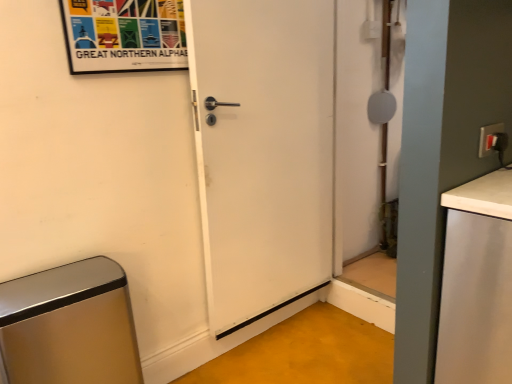
Question: Can we say metallic brushed trash can at lower left lies outside white matte countertop at right?

Choices:
 (A) yes
 (B) no

Answer: (A)

Question: Can you confirm if metallic brushed trash can at lower left is smaller than white matte countertop at right?

Choices:
 (A) yes
 (B) no

Answer: (A)

Question: Can you confirm if metallic brushed trash can at lower left is thinner than white matte countertop at right?

Choices:
 (A) yes
 (B) no

Answer: (A)

Question: Is metallic brushed trash can at lower left turned away from white matte countertop at right?

Choices:
 (A) yes
 (B) no

Answer: (B)

Question: From the image's perspective, does metallic brushed trash can at lower left appear lower than white matte countertop at right?

Choices:
 (A) yes
 (B) no

Answer: (A)

Question: Is matte white screen door at right bigger or smaller than white matte countertop at right?

Choices:
 (A) small
 (B) big

Answer: (A)

Question: In terms of height, does matte white screen door at right look taller or shorter compared to white matte countertop at right?

Choices:
 (A) tall
 (B) short

Answer: (A)

Question: Is matte white screen door at right inside the boundaries of white matte countertop at right, or outside?

Choices:
 (A) outside
 (B) inside

Answer: (A)

Question: From a real-world perspective, is matte white screen door at right physically located above or below white matte countertop at right?

Choices:
 (A) above
 (B) below

Answer: (A)

Question: Considering the positions of metallic brushed trash can at lower left and white matte countertop at right in the image, is metallic brushed trash can at lower left bigger or smaller than white matte countertop at right?

Choices:
 (A) small
 (B) big

Answer: (A)

Question: Is metallic brushed trash can at lower left situated inside white matte countertop at right or outside?

Choices:
 (A) inside
 (B) outside

Answer: (B)

Question: Considering the positions of metallic brushed trash can at lower left and white matte countertop at right in the image, is metallic brushed trash can at lower left wider or thinner than white matte countertop at right?

Choices:
 (A) wide
 (B) thin

Answer: (B)

Question: Would you say metallic brushed trash can at lower left is to the left or to the right of white matte countertop at right in the picture?

Choices:
 (A) right
 (B) left

Answer: (B)

Question: In the image, is matte paper poster at upper left positioned in front of or behind white matte countertop at right?

Choices:
 (A) behind
 (B) front

Answer: (A)

Question: Would you say matte paper poster at upper left is to the left or to the right of white matte countertop at right in the picture?

Choices:
 (A) left
 (B) right

Answer: (A)